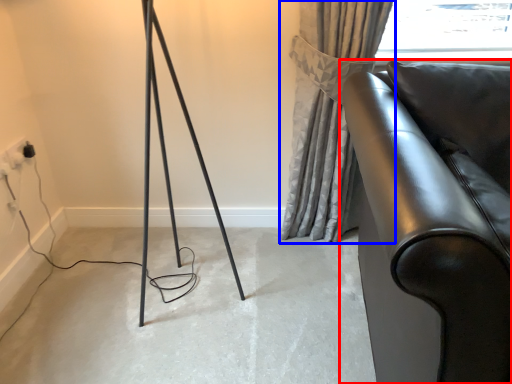
Question: Which of the following is the closest to the observer, furniture (highlighted by a red box) or curtain (highlighted by a blue box)?

Choices:
 (A) furniture
 (B) curtain

Answer: (A)